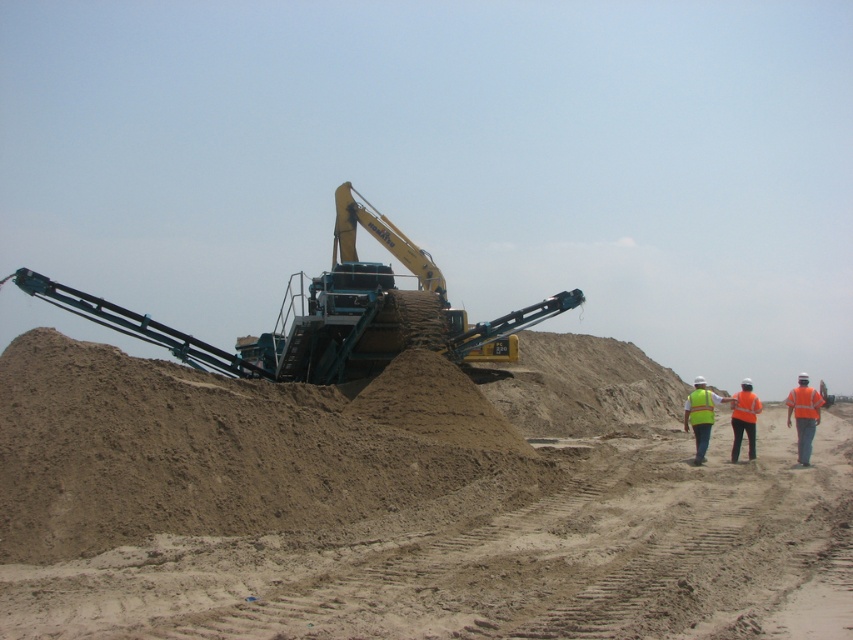
Question: Which of the following is the farthest from the observer?

Choices:
 (A) high visibility vest at center
 (B) yellow metallic excavator at center
 (C) brown sandy dirt at center

Answer: (B)

Question: Which of the following is the farthest from the observer?

Choices:
 (A) high visibility vest at center
 (B) reflective orange vest at center

Answer: (B)

Question: Considering the relative positions of yellow metallic excavator at center and reflective orange vest at center in the image provided, where is yellow metallic excavator at center located with respect to reflective orange vest at center?

Choices:
 (A) below
 (B) above

Answer: (B)

Question: Is brown sandy dirt at center bigger than high visibility vest at center?

Choices:
 (A) yes
 (B) no

Answer: (A)

Question: Which of the following is the farthest from the observer?

Choices:
 (A) brown sandy dirt at center
 (B) yellow metallic excavator at center
 (C) reflective orange vest at center
 (D) orange reflective vest at right

Answer: (B)

Question: Can you confirm if yellow metallic excavator at center is smaller than high visibility vest at center?

Choices:
 (A) yes
 (B) no

Answer: (B)